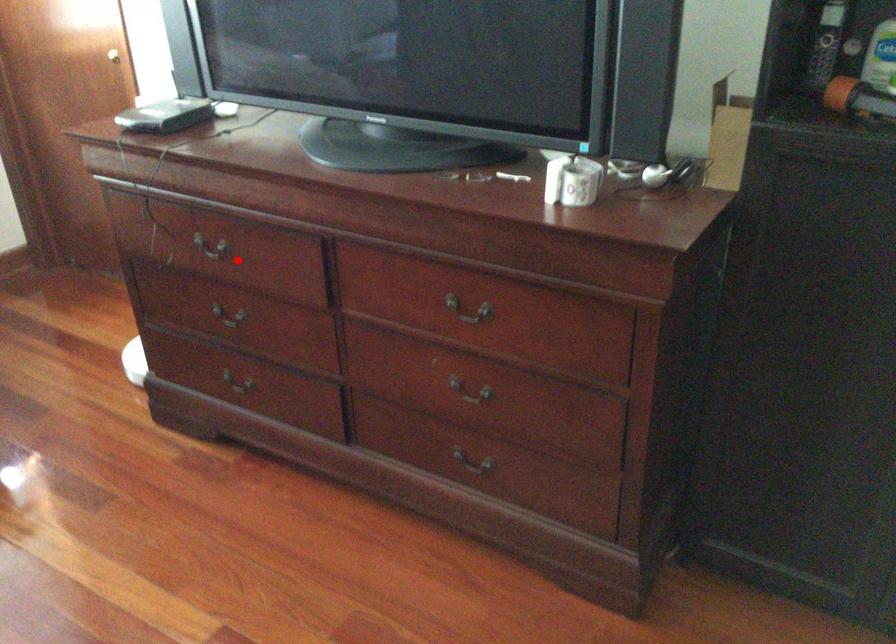
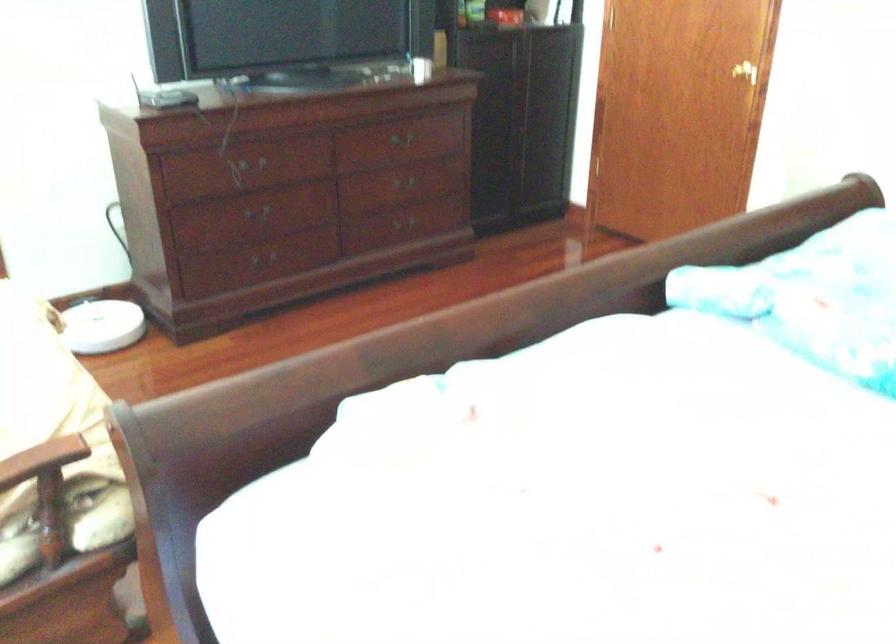
Question: I am providing you with two images of the same scene from different viewpoints. In image1, a red point is highlighted. Considering the same 3D point in image2, which of the following is correct?

Choices:
 (A) It is closer
 (B) It is farther

Answer: (B)